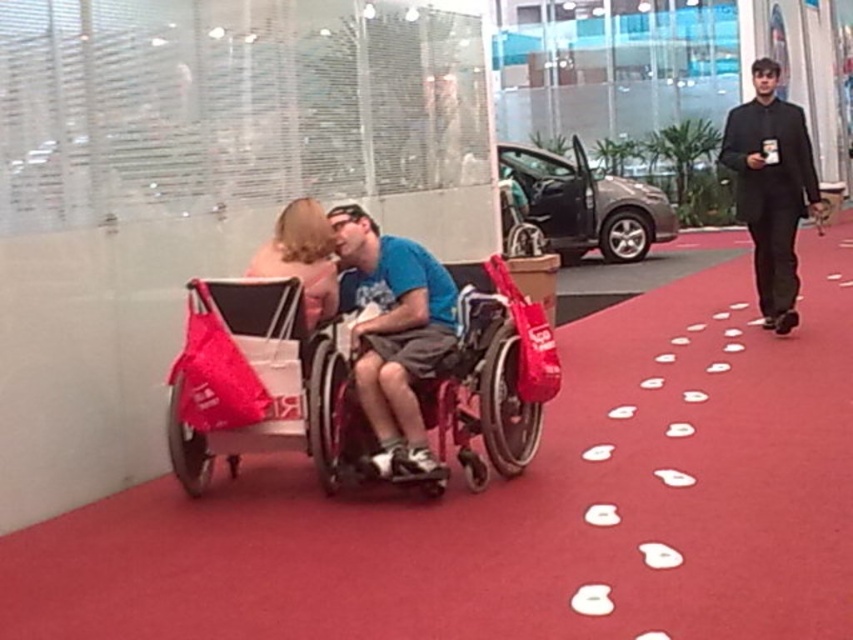
Question: Is matte red baby carriage at left bigger than blue matte shirt at center?

Choices:
 (A) no
 (B) yes

Answer: (B)

Question: Does black suit at right have a greater width compared to blonde hair at center?

Choices:
 (A) no
 (B) yes

Answer: (B)

Question: Which is nearer to the blonde hair at center?

Choices:
 (A) shiny metallic car at center
 (B) blue matte shirt at center
 (C) matte red baby carriage at left

Answer: (B)

Question: Considering the real-world distances, which object is closest to the black suit at right?

Choices:
 (A) metallic wheelchair at center
 (B) blonde hair at center
 (C) shiny metallic car at center
 (D) matte red baby carriage at left

Answer: (A)

Question: Does metallic wheelchair at center appear on the right side of shiny metallic car at center?

Choices:
 (A) no
 (B) yes

Answer: (A)

Question: Based on their relative distances, which object is nearer to the shiny metallic car at center?

Choices:
 (A) blonde hair at center
 (B) black suit at right
 (C) blue matte shirt at center
 (D) metallic wheelchair at center

Answer: (B)